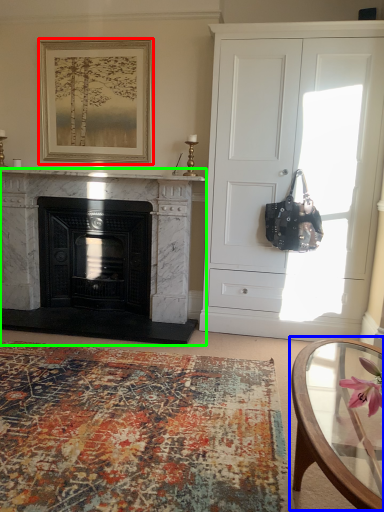
Question: Which object is the closest to the picture frame (highlighted by a red box)? Choose among these: coffee table (highlighted by a blue box) or fireplace (highlighted by a green box).

Choices:
 (A) coffee table
 (B) fireplace

Answer: (B)